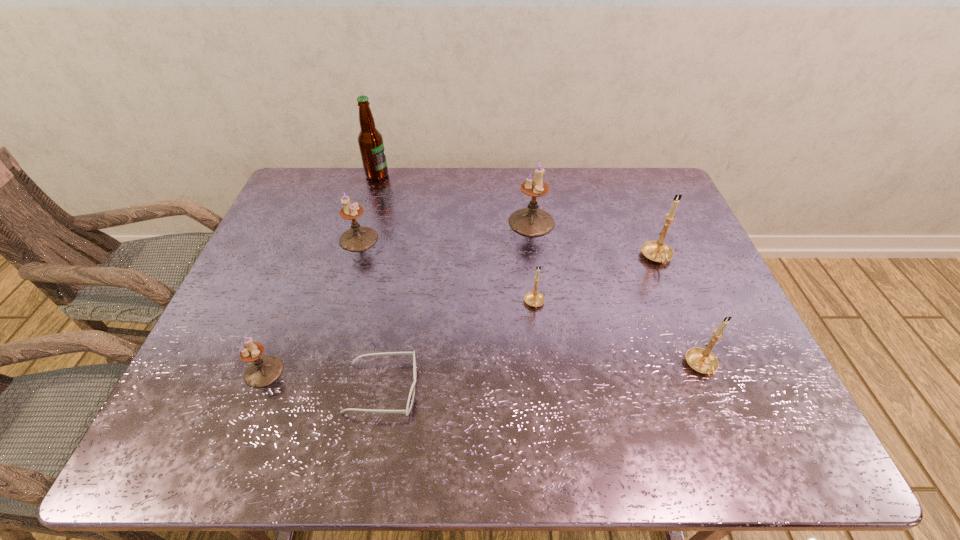
Identify the location of vacant space situated 0.120m with the lenses of the fourth object from left to right facing outward. (472, 388).

The image size is (960, 540). Identify the location of beer bottle at the far edge. tap(370, 140).

Find the location of a particular element. Image resolution: width=960 pixels, height=540 pixels. candle holder present at the far edge is located at coordinates (531, 221).

Locate an element on the screen. object that is at the near edge is located at coordinates (412, 391).

You are a GUI agent. You are given a task and a screenshot of the screen. Output one action in this format:
    pyautogui.click(x=<x>, y=<y>)
    Task: Click on the object located in the left edge section of the desktop
    
    Given the screenshot: What is the action you would take?
    pyautogui.click(x=263, y=371)

Find the location of `vacant point at the far edge`. vacant point at the far edge is located at coordinates (587, 167).

The height and width of the screenshot is (540, 960). In the image, there is a desktop. In order to click on vacant space at the near edge in this screenshot , I will do `click(326, 435)`.

At what (x,y) coordinates should I click in order to perform the action: click on free space at the right edge of the desktop. Please return your answer as a coordinate pair (x, y). The width and height of the screenshot is (960, 540). Looking at the image, I should click on (740, 414).

Locate an element on the screen. This screenshot has width=960, height=540. free point at the far right corner is located at coordinates (640, 171).

What are the coordinates of `blank region between the biggest gold candle holder and the shortest object` in the screenshot? It's located at (519, 323).